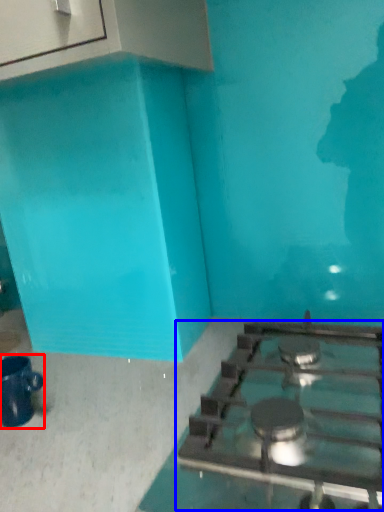
Question: Which of the following is the farthest to the observer, coffee cup (highlighted by a red box) or gas stove (highlighted by a blue box)?

Choices:
 (A) coffee cup
 (B) gas stove

Answer: (A)